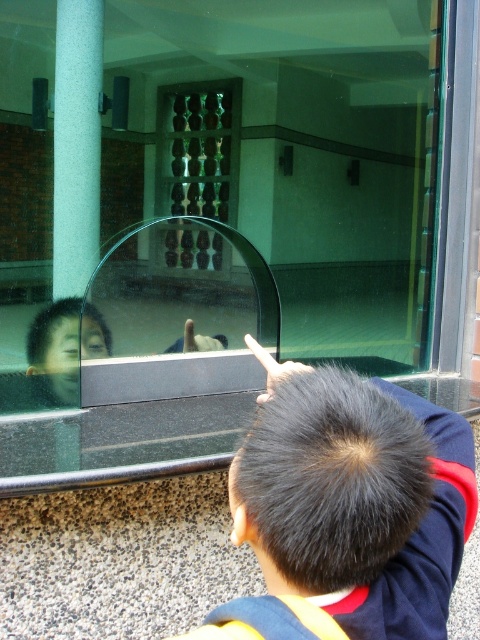
Question: Does dark brown hair at upper right appear on the right side of green textured pillar at left?

Choices:
 (A) yes
 (B) no

Answer: (A)

Question: Is dark brown hair at upper right below green textured pillar at left?

Choices:
 (A) no
 (B) yes

Answer: (B)

Question: Which point is farther to the camera?

Choices:
 (A) (70, 124)
 (B) (458, 497)

Answer: (A)

Question: Is dark brown hair at upper right thinner than green textured pillar at left?

Choices:
 (A) no
 (B) yes

Answer: (B)

Question: Which point is closer to the camera?

Choices:
 (A) (455, 419)
 (B) (72, 240)

Answer: (A)